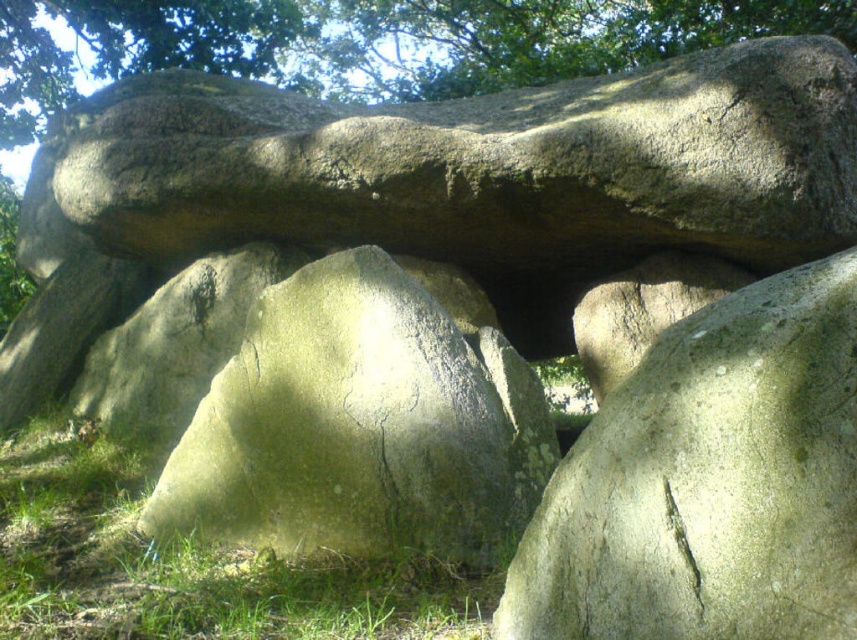
Question: Estimate the real-world distances between objects in this image. Which object is closer to the green grass at lower left?

Choices:
 (A) greenish-gray rock at center
 (B) smooth gray rock at center
 (C) green leafy tree at upper center
 (D) gray rough rock at upper center

Answer: (A)

Question: Is smooth gray rock at center smaller than green leafy tree at upper center?

Choices:
 (A) no
 (B) yes

Answer: (A)

Question: Which point appears closest to the camera in this image?

Choices:
 (A) (258, 588)
 (B) (382, 209)
 (C) (490, 448)
 (D) (280, 60)

Answer: (A)

Question: Does greenish-gray rock at center come in front of green leafy tree at upper center?

Choices:
 (A) yes
 (B) no

Answer: (A)

Question: Does greenish-gray rock at center appear under green leafy tree at upper center?

Choices:
 (A) no
 (B) yes

Answer: (B)

Question: Among these objects, which one is nearest to the camera?

Choices:
 (A) green leafy tree at upper center
 (B) greenish-gray rock at center
 (C) smooth gray rock at center
 (D) green grass at lower left

Answer: (C)